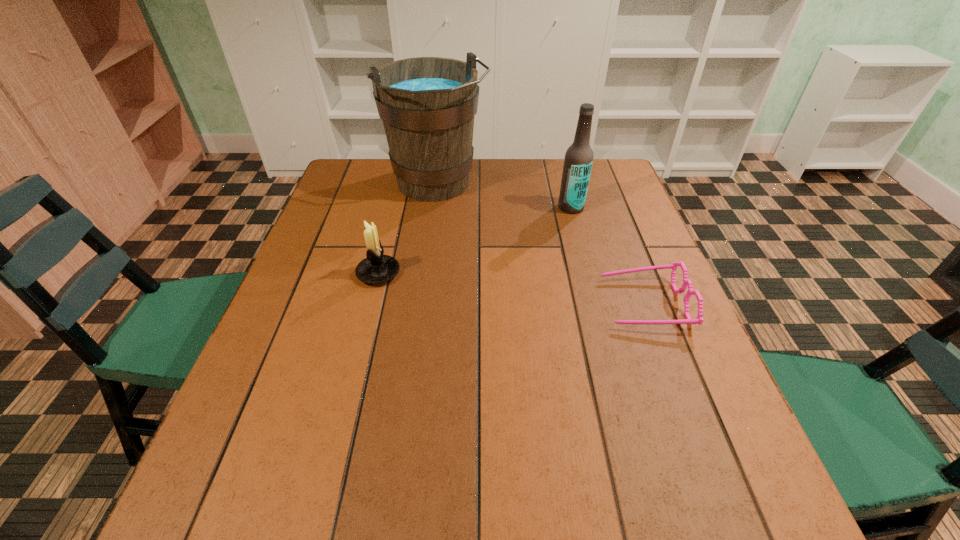
I want to click on free space in the image that satisfies the following two spatial constraints: 1. on the front side of the tallest object; 2. on the arms of the spectacles, so pos(422,303).